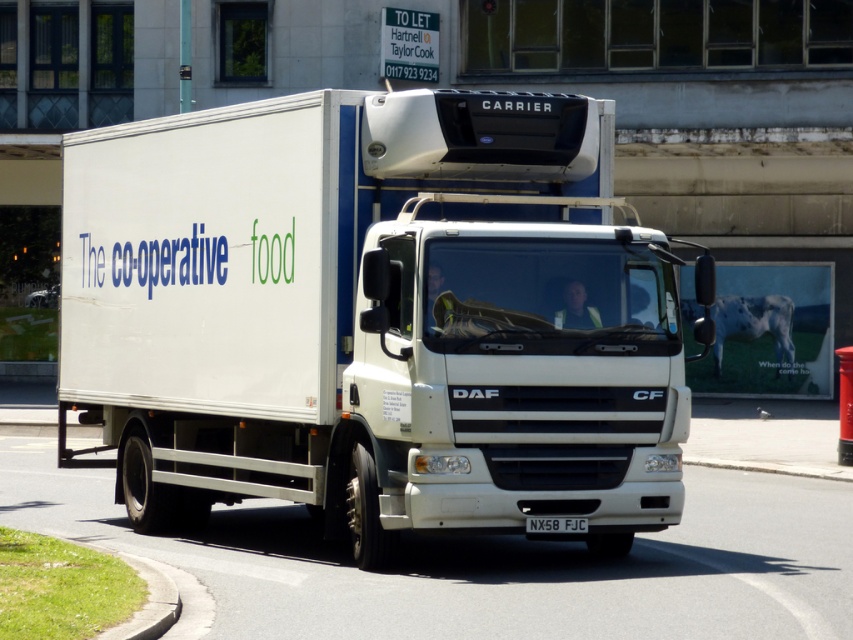
Question: Which object is farther from the camera taking this photo?

Choices:
 (A) white matte truck at center
 (B) white plastic license plate at center

Answer: (A)

Question: Can you confirm if white matte truck at center is positioned to the left of white plastic license plate at center?

Choices:
 (A) no
 (B) yes

Answer: (B)

Question: Which object appears closest to the camera in this image?

Choices:
 (A) white matte truck at center
 (B) white plastic license plate at center

Answer: (B)

Question: Which of the following is the farthest from the observer?

Choices:
 (A) pyautogui.click(x=173, y=124)
 (B) pyautogui.click(x=585, y=524)

Answer: (A)

Question: Is the position of white matte truck at center more distant than that of white plastic license plate at center?

Choices:
 (A) no
 (B) yes

Answer: (B)

Question: Is white matte truck at center smaller than white plastic license plate at center?

Choices:
 (A) yes
 (B) no

Answer: (B)